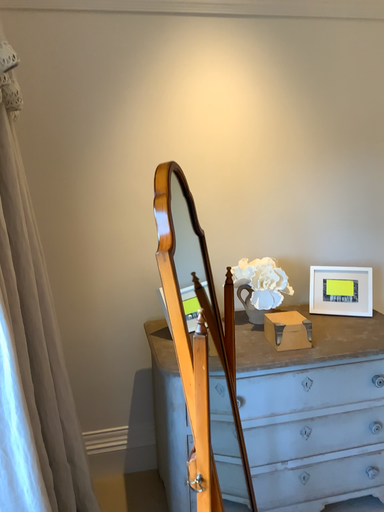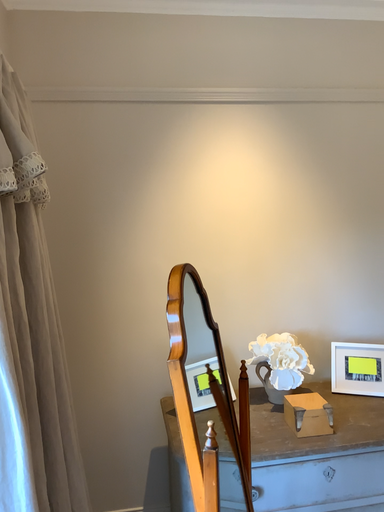
Question: Which way did the camera rotate in the video?

Choices:
 (A) rotated downward
 (B) rotated upward

Answer: (B)